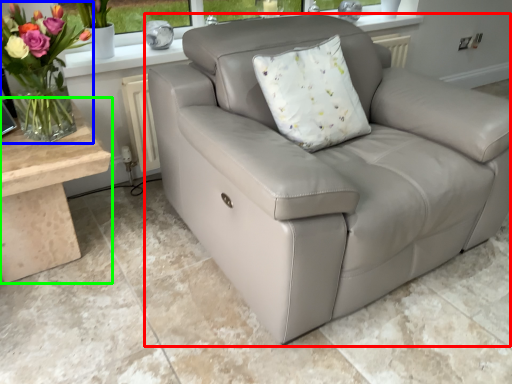
Question: Estimate the real-world distances between objects in this image. Which object is closer to studio couch (highlighted by a red box), floral arrangement (highlighted by a blue box) or table (highlighted by a green box)?

Choices:
 (A) floral arrangement
 (B) table

Answer: (B)